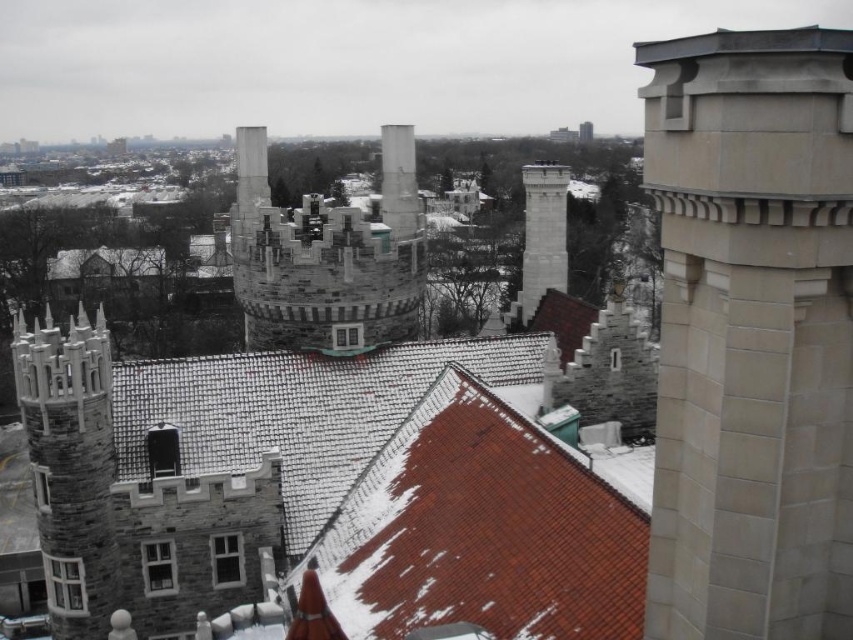
Question: Is slate gray stone tower at upper right closer to camera compared to white stone chimney at center?

Choices:
 (A) no
 (B) yes

Answer: (B)

Question: Which object is positioned farthest from the slate gray stone tower at upper right?

Choices:
 (A) red tile roof at center
 (B) stone chimney at center-left
 (C) red shingles at center
 (D) stone brick castle at center

Answer: (B)

Question: Observing the image, what is the correct spatial positioning of slate gray stone tower at upper right in reference to red shingles at center?

Choices:
 (A) right
 (B) left

Answer: (A)

Question: Which point is farther to the camera?

Choices:
 (A) (701, 598)
 (B) (67, 476)

Answer: (B)

Question: Can you confirm if red shingles at center is positioned below white stone chimney at center?

Choices:
 (A) no
 (B) yes

Answer: (B)

Question: Which point is farther from the camera taking this photo?

Choices:
 (A) (534, 273)
 (B) (303, 326)
 (C) (409, 552)
 (D) (67, 490)

Answer: (A)